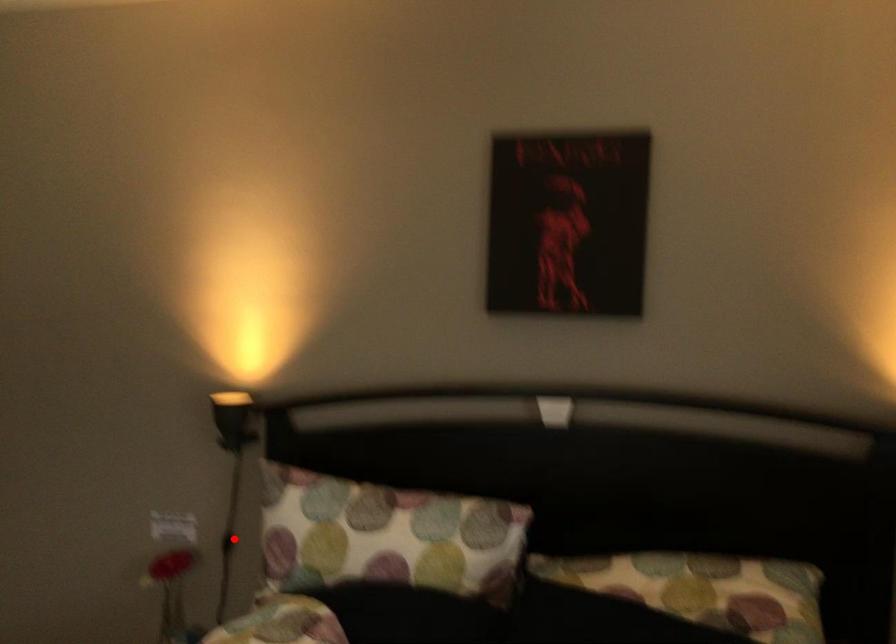
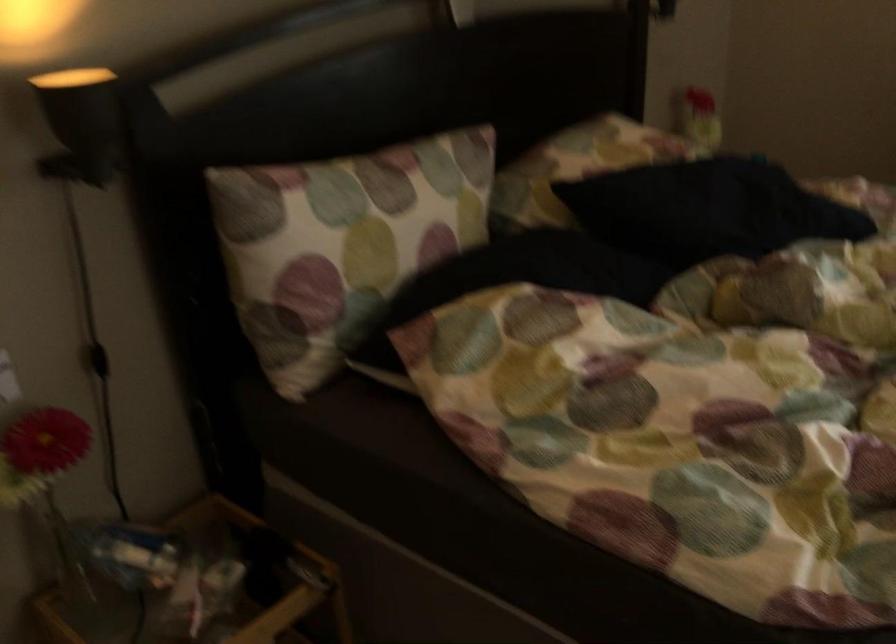
Locate, in the second image, the point that corresponds to the highlighted location in the first image.

(98, 360)